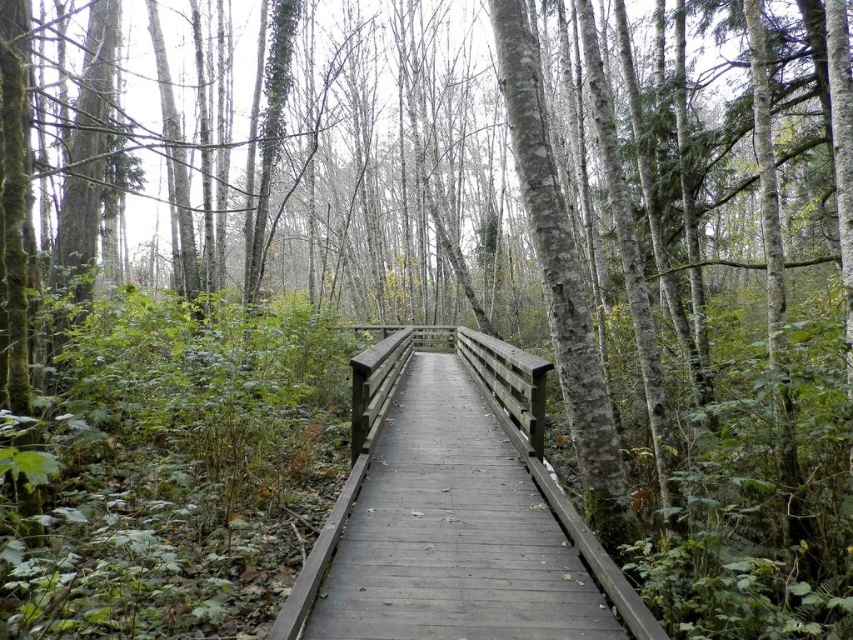
Based on the scene description, where is the smooth wooden bridge at center located in terms of its 2D coordinates?

The smooth wooden bridge at center is located at the 2D coordinates of point (453, 532).

You are a hiker walking along the wooden boardwalk in the forest. You notice the smooth wooden bridge at center and the smooth wooden railing at center. Which object is positioned lower relative to the other?

The smooth wooden bridge at center is located below the smooth wooden railing at center, so it is positioned lower.